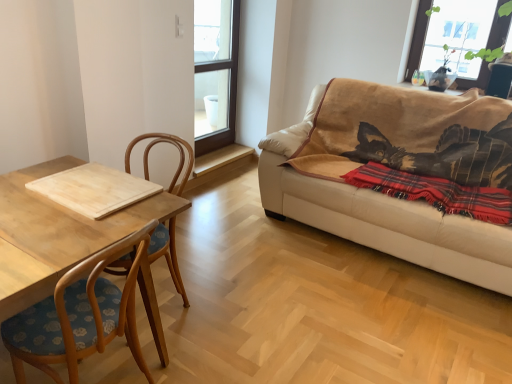
Question: Looking at the image, does red plaid blanket at right seem bigger or smaller compared to transparent glass window at upper center, arranged as the 2th window when viewed from the right?

Choices:
 (A) big
 (B) small

Answer: (B)

Question: Considering the positions of point (449, 185) and point (200, 36), is point (449, 185) closer or farther from the camera than point (200, 36)?

Choices:
 (A) farther
 (B) closer

Answer: (B)

Question: Which object is the farthest from the transparent glass window at upper center, arranged as the 2th window when viewed from the right?

Choices:
 (A) beige leather couch at right
 (B) transparent glass window at upper right, which is counted as the second window, starting from the left
 (C) light wood cutting board at left
 (D) red plaid blanket at right
 (E) light wood cutting board at left

Answer: (E)

Question: Which of these objects is positioned farthest from the light wood cutting board at left?

Choices:
 (A) beige leather couch at right
 (B) red plaid blanket at right
 (C) transparent glass window at upper center, which is the first window from left to right
 (D) transparent glass window at upper right, which is counted as the second window, starting from the left
 (E) light wood cutting board at left

Answer: (D)